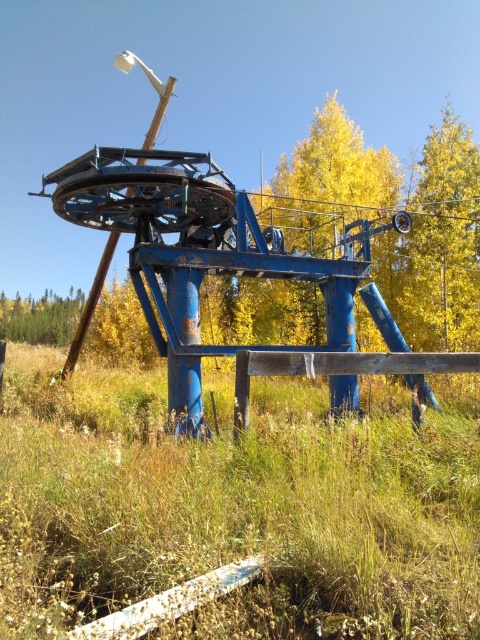
Which is more to the left, green grassy at lower center or green matte tree at lower left?

From the viewer's perspective, green matte tree at lower left appears more on the left side.

Is green grassy at lower center in front of green matte tree at lower left?

Yes, green grassy at lower center is closer to the viewer.

Is point (312, 461) closer to viewer compared to point (31, 340)?

Yes, it is in front of point (31, 340).

At what (x,y) coordinates should I click in order to perform the action: click on green grassy at lower center. Please return your answer as a coordinate pair (x, y). This screenshot has width=480, height=640. Looking at the image, I should click on (233, 504).

Can you confirm if green grassy at lower center is bigger than yellow leafy tree at center?

Incorrect, green grassy at lower center is not larger than yellow leafy tree at center.

Is green grassy at lower center to the right of yellow leafy tree at center from the viewer's perspective?

Incorrect, green grassy at lower center is not on the right side of yellow leafy tree at center.

Does point (291, 380) come in front of point (237, 317)?

Yes, point (291, 380) is in front of point (237, 317).

The height and width of the screenshot is (640, 480). In order to click on green grassy at lower center in this screenshot , I will do `click(233, 504)`.

Between point (330, 193) and point (40, 301), which one is positioned behind?

The point (40, 301) is more distant.

The height and width of the screenshot is (640, 480). Describe the element at coordinates (334, 170) in the screenshot. I see `yellow leafy tree at center` at that location.

Where is `yellow leafy tree at center`? This screenshot has width=480, height=640. yellow leafy tree at center is located at coordinates (334, 170).